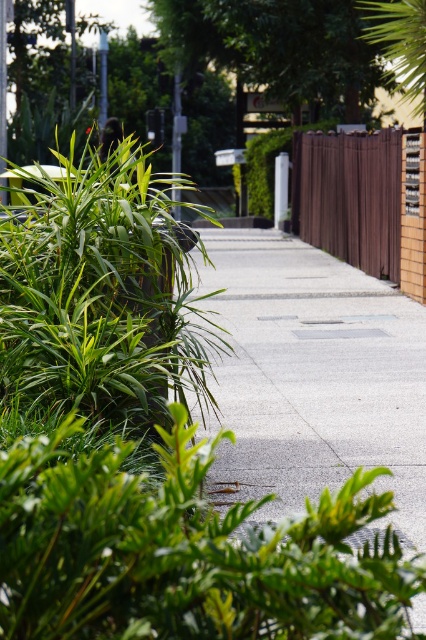
Who is higher up, concrete sidewalk at center or brown wooden fence at right?

Positioned higher is brown wooden fence at right.

How distant is concrete sidewalk at center from brown wooden fence at right?

A distance of 7.57 feet exists between concrete sidewalk at center and brown wooden fence at right.

Which is in front, point (276, 472) or point (394, 228)?

Point (276, 472)

You are a GUI agent. You are given a task and a screenshot of the screen. Output one action in this format:
    pyautogui.click(x=<x>, y=<y>)
    Task: Click on the concrete sidewalk at center
    Image resolution: width=426 pixels, height=640 pixels.
    Given the screenshot: What is the action you would take?
    pyautogui.click(x=314, y=376)

Is the position of concrete sidewalk at center more distant than that of green leafy bush at left?

No, it is not.

Does concrete sidewalk at center appear on the left side of green leafy bush at left?

No, concrete sidewalk at center is not to the left of green leafy bush at left.

Identify the location of concrete sidewalk at center. (314, 376).

Where is `concrete sidewalk at center`? Image resolution: width=426 pixels, height=640 pixels. concrete sidewalk at center is located at coordinates (314, 376).

Is point (232, 282) behind point (393, 56)?

Yes, point (232, 282) is behind point (393, 56).

Where is `concrete sidewalk at center`? The height and width of the screenshot is (640, 426). concrete sidewalk at center is located at coordinates (314, 376).